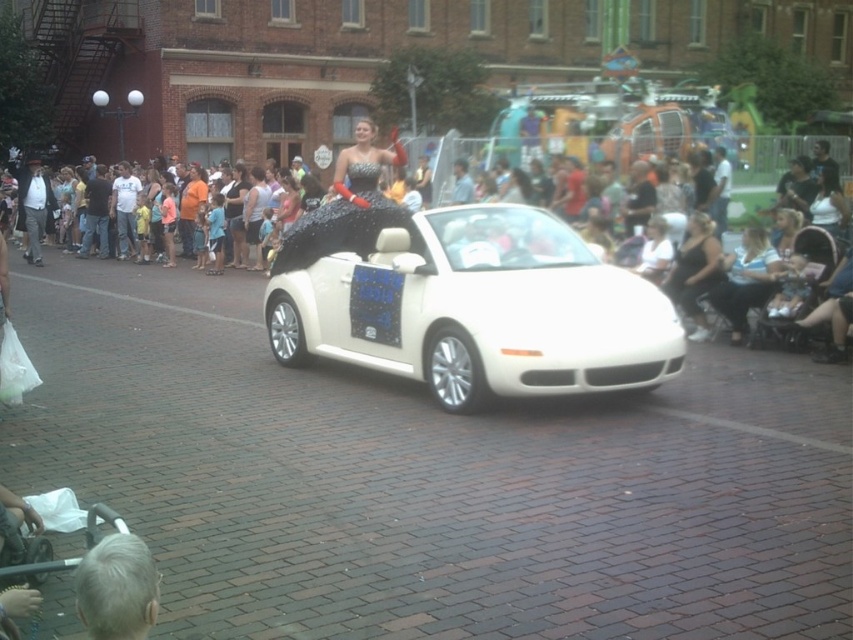
Question: Does matte black dress at center have a smaller size compared to gray hair at lower left?

Choices:
 (A) yes
 (B) no

Answer: (B)

Question: Which point is farther to the camera?

Choices:
 (A) white glossy convertible at center
 (B) matte black dress at center
 (C) gray hair at lower left
 (D) sparkly black dress at center

Answer: (D)

Question: Which point appears farthest from the camera in this image?

Choices:
 (A) (828, 196)
 (B) (358, 314)
 (C) (363, 179)

Answer: (A)

Question: Is matte black dress at center above sparkly black dress at center?

Choices:
 (A) yes
 (B) no

Answer: (B)

Question: Among these points, which one is nearest to the camera?

Choices:
 (A) (x=440, y=380)
 (B) (x=519, y=300)
 (C) (x=128, y=620)
 (D) (x=392, y=145)

Answer: (C)

Question: Does white glossy convertible at center appear on the left side of matte black dress at center?

Choices:
 (A) no
 (B) yes

Answer: (B)